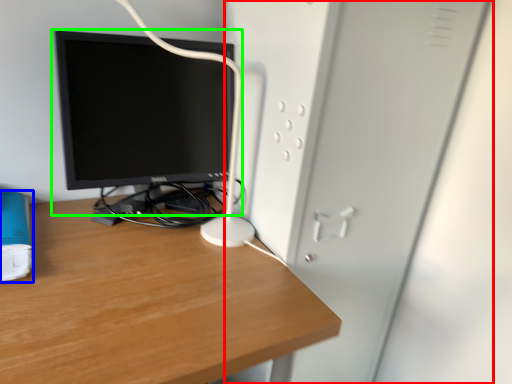
Question: Estimate the real-world distances between objects in this image. Which object is closer to file cabinet (highlighted by a red box), paperback book (highlighted by a blue box) or computer monitor (highlighted by a green box)?

Choices:
 (A) paperback book
 (B) computer monitor

Answer: (B)